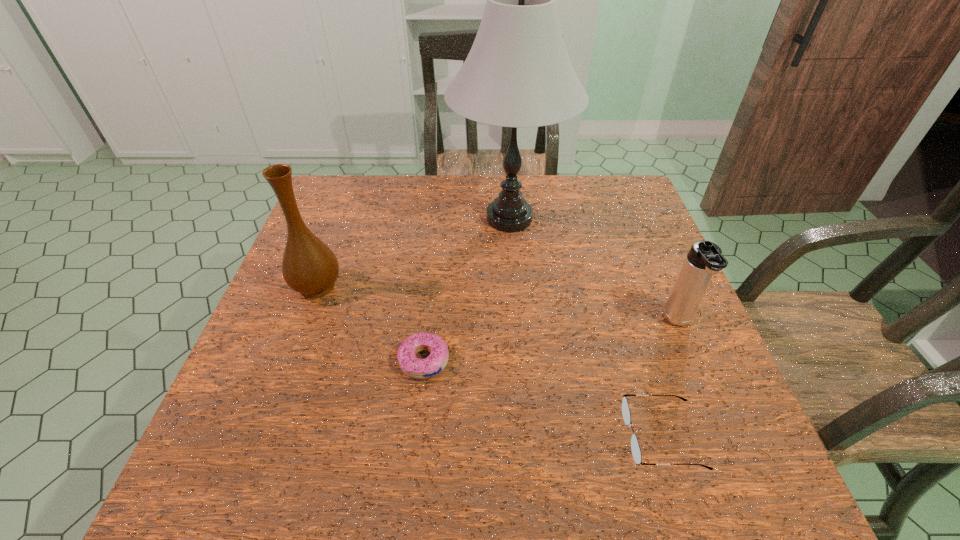
Image resolution: width=960 pixels, height=540 pixels. Find the location of `the farthest object`. the farthest object is located at coordinates (517, 74).

Where is `lamp`? This screenshot has height=540, width=960. lamp is located at coordinates (517, 74).

Where is `the leftmost object`? This screenshot has width=960, height=540. the leftmost object is located at coordinates (309, 267).

What are the coordinates of `the fourth nearest object` in the screenshot? It's located at (309, 267).

Where is `thermos bottle`? The image size is (960, 540). thermos bottle is located at coordinates (705, 259).

Locate an element on the screen. the rightmost object is located at coordinates (705, 259).

At what (x,y) coordinates should I click in order to perform the action: click on the nearest object. Please return your answer as a coordinate pair (x, y). This screenshot has width=960, height=540. Looking at the image, I should click on tap(635, 448).

I want to click on the fourth object from left to right, so click(635, 448).

I want to click on doughnut, so click(x=412, y=366).

Identify the location of vacant area located 0.200m on the left of the lamp. (381, 219).